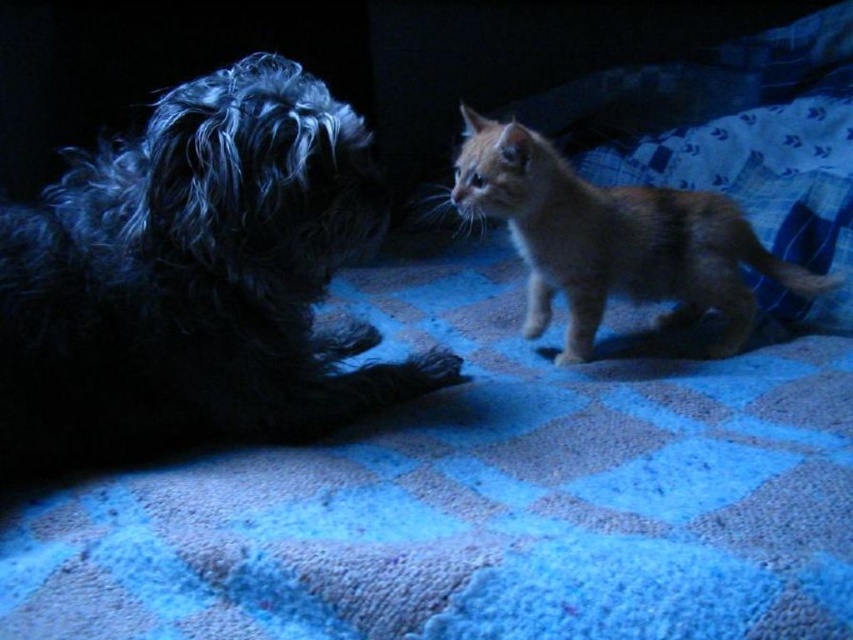
You are standing in the room where the shaggy black dog at left is located. If you want to move closer to the dog, should you walk towards the left or right side of the room?

The shaggy black dog at left is positioned on the left side of the frame, so to move closer to it, you should walk towards the left side of the room.

You are a photographer aiming to capture a closeup of the black dog and the orange kitten on the blanket. You are currently at a position 37.45 inches away from the point marked at coordinates point (251, 90). Can you fit both animals into your shot without moving the camera?

The point marked at coordinates point (251, 90) is 37.45 inches away from the camera. However, the question does not provide information about the field of view or zoom level of the camera, so it is impossible to determine if both animals can be captured in the shot without additional details.

You are a photographer setting up a night shoot indoors. You have a spotlight that can only illuminate objects within a 1 meter radius. The shaggy black dog at left and the orange fur cat at center are in the scene. Can you light both subjects adequately with one spotlight placement?

The shaggy black dog at left is positioned over orange fur cat at center. Since they are close to each other, the spotlight can be placed between them to ensure both are within the 1 meter radius, thus adequately lighting both subjects.